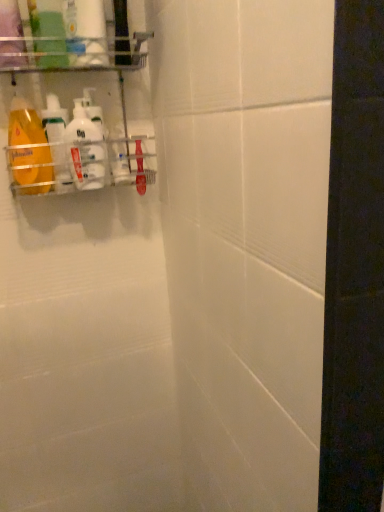
Question: Is the depth of white glossy bottle at upper left, the fifth cleaning product in the left-to-right sequence, greater than that of white glossy bottle at upper left, which is the second cleaning product from right to left?

Choices:
 (A) no
 (B) yes

Answer: (B)

Question: Is white glossy bottle at upper left, the fifth cleaning product in the left-to-right sequence, at the right side of white glossy bottle at upper left, the fourth cleaning product when ordered from left to right?

Choices:
 (A) no
 (B) yes

Answer: (B)

Question: Would you consider white glossy bottle at upper left, the first cleaning product from the right, to be distant from white glossy bottle at upper left, the fourth cleaning product when ordered from left to right?

Choices:
 (A) yes
 (B) no

Answer: (B)

Question: Can you confirm if white glossy bottle at upper left, the first cleaning product from the right, is positioned to the left of white glossy bottle at upper left, the fourth cleaning product when ordered from left to right?

Choices:
 (A) no
 (B) yes

Answer: (A)

Question: Could white glossy bottle at upper left, which is the second cleaning product from right to left, be considered to be inside white glossy bottle at upper left, the fifth cleaning product in the left-to-right sequence?

Choices:
 (A) yes
 (B) no

Answer: (B)

Question: Visually, is white glossy bottle at upper left, the fifth cleaning product in the left-to-right sequence, positioned to the left or to the right of white glossy bottle at left, which is the 3th cleaning product in left-to-right order?

Choices:
 (A) right
 (B) left

Answer: (A)

Question: Does point (109, 176) appear closer or farther from the camera than point (72, 176)?

Choices:
 (A) closer
 (B) farther

Answer: (B)

Question: From the image's perspective, is white glossy bottle at upper left, the first cleaning product from the right, above or below white glossy bottle at left, the 3th cleaning product positioned from the right?

Choices:
 (A) above
 (B) below

Answer: (A)

Question: Is white glossy bottle at upper left, the first cleaning product from the right, bigger or smaller than white glossy bottle at left, which is the 3th cleaning product in left-to-right order?

Choices:
 (A) big
 (B) small

Answer: (B)

Question: Is point (94, 117) closer or farther from the camera than point (104, 17)?

Choices:
 (A) farther
 (B) closer

Answer: (A)

Question: From a real-world perspective, is white glossy bottle at upper left, the fifth cleaning product in the left-to-right sequence, above or below white glossy bottle at upper left, which is the second cleaning product from right to left?

Choices:
 (A) above
 (B) below

Answer: (B)

Question: Considering the relative positions of white glossy bottle at upper left, the fifth cleaning product in the left-to-right sequence, and white glossy bottle at upper left, the fourth cleaning product when ordered from left to right, in the image provided, is white glossy bottle at upper left, the fifth cleaning product in the left-to-right sequence, to the left or to the right of white glossy bottle at upper left, the fourth cleaning product when ordered from left to right,?

Choices:
 (A) left
 (B) right

Answer: (B)

Question: Is white glossy bottle at upper left, the fifth cleaning product in the left-to-right sequence, inside the boundaries of white glossy bottle at upper left, the fourth cleaning product when ordered from left to right, or outside?

Choices:
 (A) inside
 (B) outside

Answer: (B)

Question: From the image's perspective, is white glossy bottle at left, the 3th cleaning product positioned from the right, positioned above or below white glossy bottle at upper left, which is the second cleaning product from right to left?

Choices:
 (A) below
 (B) above

Answer: (A)

Question: From a real-world perspective, relative to white glossy bottle at upper left, the fourth cleaning product when ordered from left to right, is white glossy bottle at left, the 3th cleaning product positioned from the right, vertically above or below?

Choices:
 (A) above
 (B) below

Answer: (B)